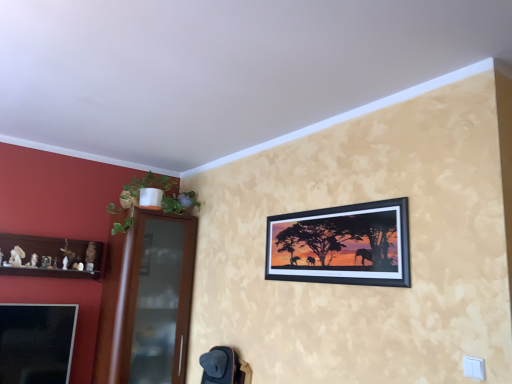
Question: Is black matte picture frame at upper center to the left of green leafy plant at left from the viewer's perspective?

Choices:
 (A) yes
 (B) no

Answer: (B)

Question: Can you confirm if black matte picture frame at upper center is shorter than green leafy plant at left?

Choices:
 (A) yes
 (B) no

Answer: (A)

Question: From the image's perspective, is black matte picture frame at upper center under green leafy plant at left?

Choices:
 (A) no
 (B) yes

Answer: (B)

Question: Is black matte picture frame at upper center bigger than green leafy plant at left?

Choices:
 (A) yes
 (B) no

Answer: (B)

Question: Can you confirm if black matte picture frame at upper center is taller than green leafy plant at left?

Choices:
 (A) no
 (B) yes

Answer: (A)

Question: Considering their positions, is green leafy plant at left located in front of or behind brown glass door at left?

Choices:
 (A) front
 (B) behind

Answer: (A)

Question: Is green leafy plant at left spatially inside brown glass door at left, or outside of it?

Choices:
 (A) outside
 (B) inside

Answer: (A)

Question: Considering the positions of point (119, 200) and point (144, 223), is point (119, 200) closer or farther from the camera than point (144, 223)?

Choices:
 (A) closer
 (B) farther

Answer: (B)

Question: From the image's perspective, is green leafy plant at left above or below brown glass door at left?

Choices:
 (A) below
 (B) above

Answer: (B)

Question: Is point (165, 187) closer or farther from the camera than point (340, 256)?

Choices:
 (A) farther
 (B) closer

Answer: (A)

Question: Do you think green leafy plant at left is within black matte picture frame at upper center, or outside of it?

Choices:
 (A) outside
 (B) inside

Answer: (A)

Question: Is green leafy plant at left in front of or behind black matte picture frame at upper center in the image?

Choices:
 (A) behind
 (B) front

Answer: (A)

Question: From the image's perspective, relative to black matte picture frame at upper center, is green leafy plant at left above or below?

Choices:
 (A) below
 (B) above

Answer: (B)

Question: Which is correct: brown glass door at left is inside black matte picture frame at upper center, or outside of it?

Choices:
 (A) inside
 (B) outside

Answer: (B)

Question: Is brown glass door at left taller or shorter than black matte picture frame at upper center?

Choices:
 (A) short
 (B) tall

Answer: (B)